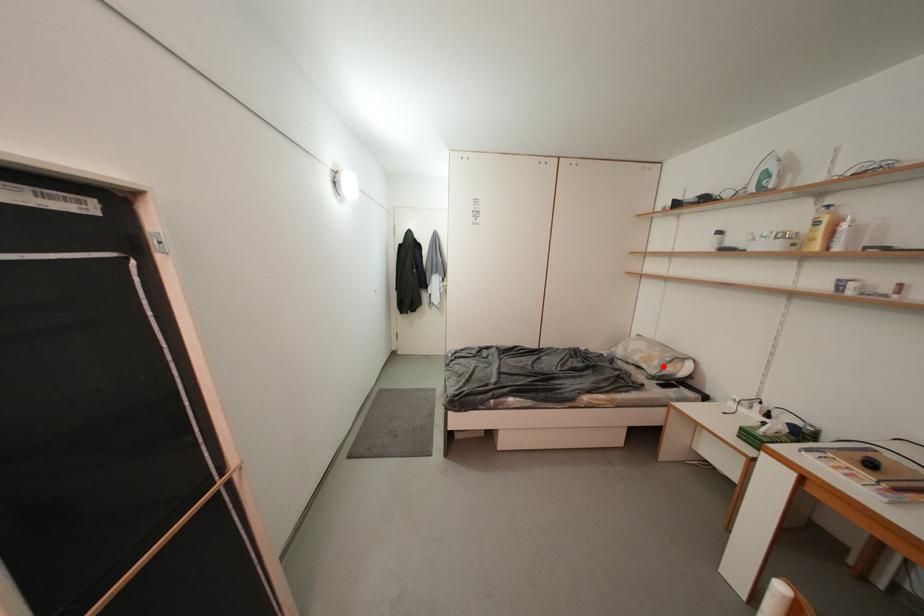
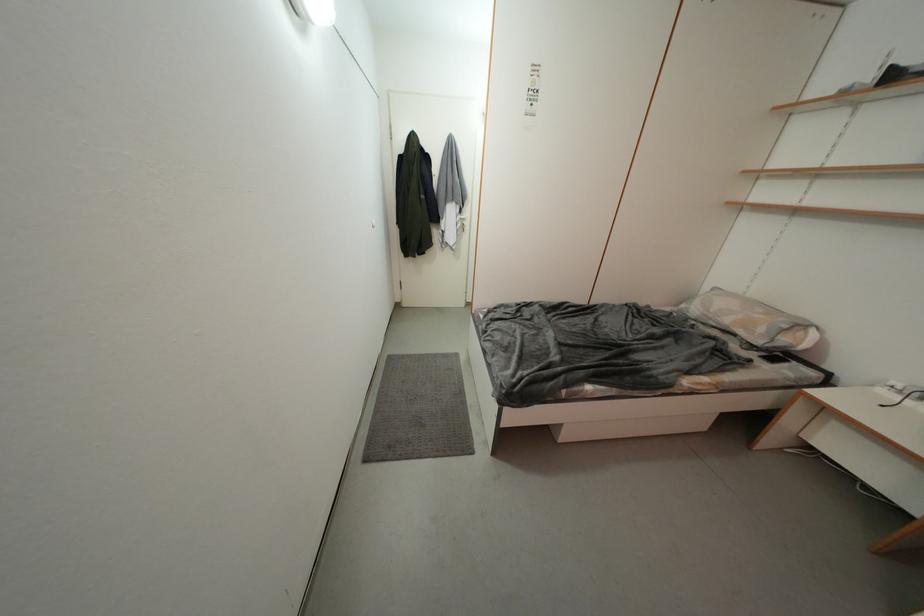
The point at the highlighted location is marked in the first image. Where is the corresponding point in the second image?

(769, 333)